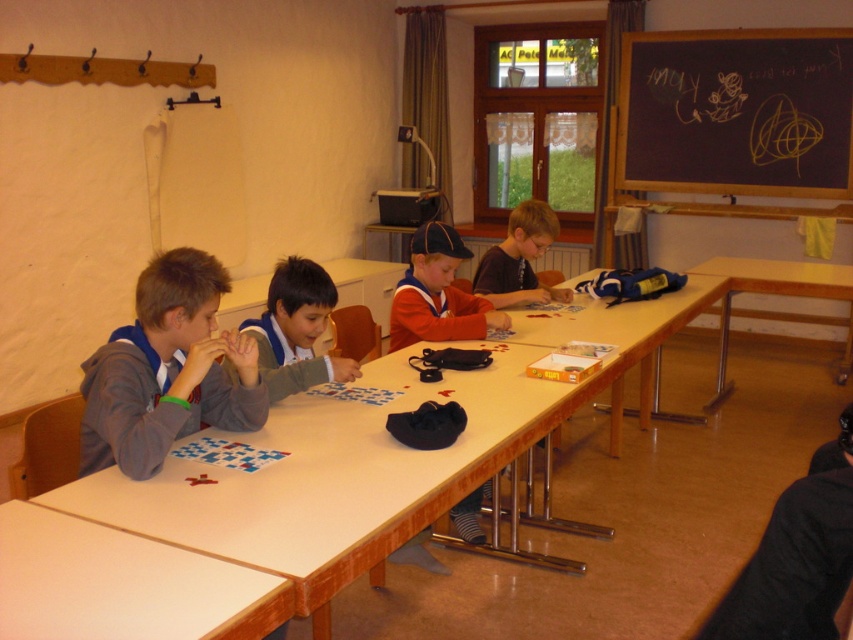
Question: Can you confirm if matte red sweater at center is positioned above wooden table at right?

Choices:
 (A) yes
 (B) no

Answer: (A)

Question: Among these objects, which one is nearest to the camera?

Choices:
 (A) black chalkboard at upper right
 (B) white matte table at lower left
 (C) wooden table at right
 (D) blue uniform shirt at center

Answer: (B)

Question: Which of the following is the farthest from the observer?

Choices:
 (A) (263, 353)
 (B) (241, 547)

Answer: (A)

Question: Can you confirm if orange fabric shirt at center is bigger than wooden table at right?

Choices:
 (A) yes
 (B) no

Answer: (B)

Question: Which point is closer to the camera?

Choices:
 (A) orange fabric shirt at center
 (B) blue uniform shirt at center

Answer: (B)

Question: Can you confirm if gray fleece jacket at left is positioned above blue uniform shirt at center?

Choices:
 (A) no
 (B) yes

Answer: (A)